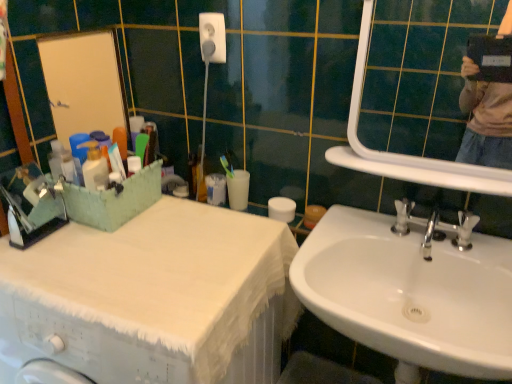
Question: Can white glossy sink at lower right be found inside white glossy mirror at upper right?

Choices:
 (A) yes
 (B) no

Answer: (B)

Question: Is white glossy mirror at upper right to the left of white glossy sink at lower right from the viewer's perspective?

Choices:
 (A) no
 (B) yes

Answer: (A)

Question: Is white glossy mirror at upper right facing towards white glossy sink at lower right?

Choices:
 (A) no
 (B) yes

Answer: (A)

Question: Does white glossy mirror at upper right have a lesser height compared to white glossy sink at lower right?

Choices:
 (A) no
 (B) yes

Answer: (A)

Question: Is white glossy mirror at upper right beside white glossy sink at lower right?

Choices:
 (A) no
 (B) yes

Answer: (A)

Question: Considering the relative positions of white glossy sink at lower right and white glossy mirror at upper right in the image provided, is white glossy sink at lower right to the left or to the right of white glossy mirror at upper right?

Choices:
 (A) right
 (B) left

Answer: (B)

Question: In the image, is white glossy sink at lower right positioned in front of or behind white glossy mirror at upper right?

Choices:
 (A) behind
 (B) front

Answer: (B)

Question: Considering the positions of point (352, 284) and point (474, 18), is point (352, 284) closer or farther from the camera than point (474, 18)?

Choices:
 (A) closer
 (B) farther

Answer: (B)

Question: From the image's perspective, is white glossy sink at lower right above or below white glossy mirror at upper right?

Choices:
 (A) above
 (B) below

Answer: (B)

Question: In terms of height, does white matte toilet paper at center look taller or shorter compared to white fabric covered at left?

Choices:
 (A) short
 (B) tall

Answer: (A)

Question: Is white matte toilet paper at center in front of or behind white fabric covered at left in the image?

Choices:
 (A) front
 (B) behind

Answer: (B)

Question: Considering the positions of white matte toilet paper at center and white fabric covered at left in the image, is white matte toilet paper at center bigger or smaller than white fabric covered at left?

Choices:
 (A) big
 (B) small

Answer: (B)

Question: Which is correct: white matte toilet paper at center is inside white fabric covered at left, or outside of it?

Choices:
 (A) inside
 (B) outside

Answer: (B)

Question: In terms of size, does white glossy sink at lower right appear bigger or smaller than white matte toilet paper at center?

Choices:
 (A) small
 (B) big

Answer: (B)

Question: Is white glossy sink at lower right situated inside white matte toilet paper at center or outside?

Choices:
 (A) inside
 (B) outside

Answer: (B)